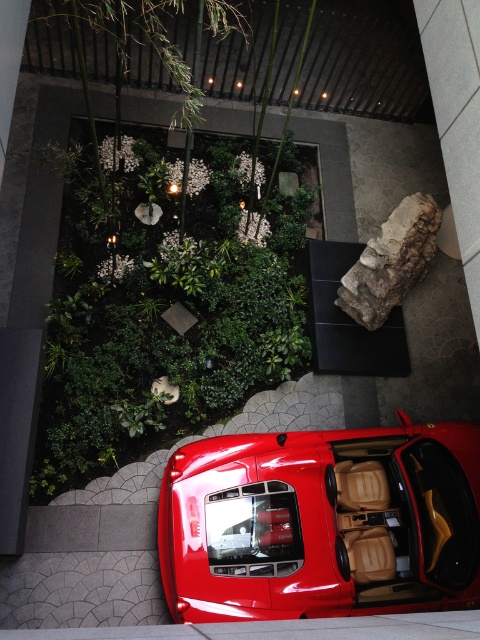
You are standing in the middle of the room and want to place a small decorative stone exactly where the green leafy plant at center is currently located. Is this possible?

The green leafy plant at center is located at point (167, 323), so yes, you can place the small decorative stone there by moving the plant first.

You are a visitor standing in the indoor garden and want to take a photo of both the green leafy plant at center and the glossy red car at center. Can you position yourself so that both objects are visible in the same frame without moving either object?

Yes, since the green leafy plant at center is above the glossy red car at center, you can position yourself at an angle where both the plant and the car are within the camera frame by looking upwards slightly to include the plant while still capturing the car below it.